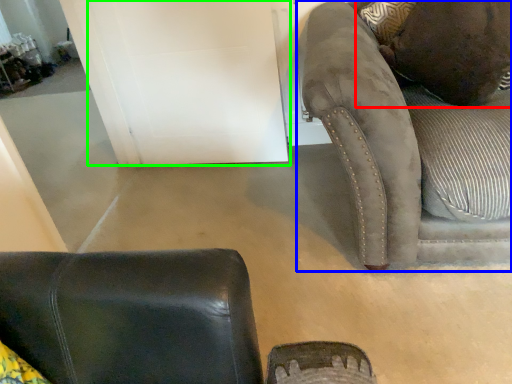
Question: Considering the real-world distances, which object is farthest from pillow (highlighted by a red box)? studio couch (highlighted by a blue box) or door (highlighted by a green box)?

Choices:
 (A) studio couch
 (B) door

Answer: (B)